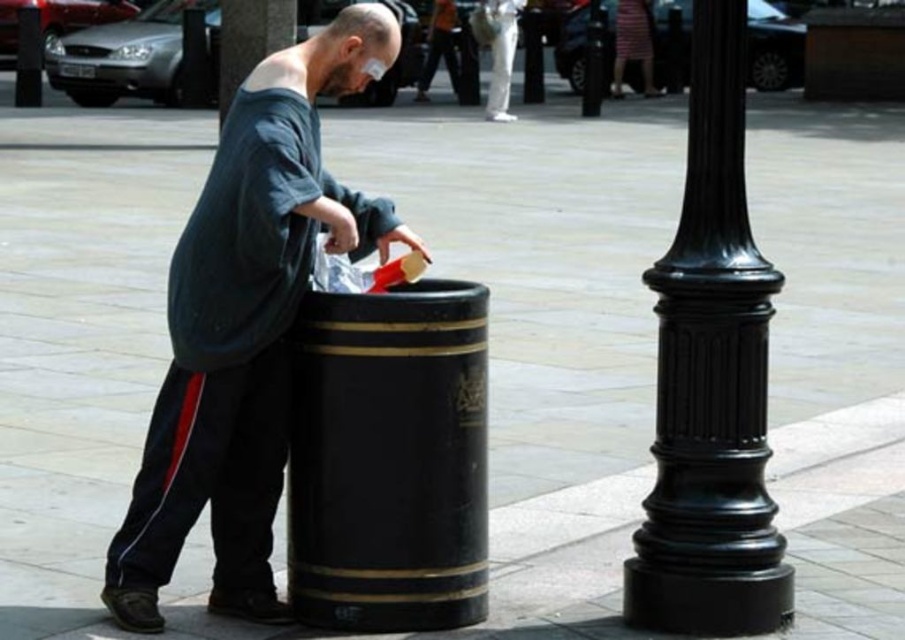
Question: Among these points, which one is farthest from the camera?

Choices:
 (A) (439, 420)
 (B) (237, 42)

Answer: (B)

Question: Is matte black trash can at center to the left of black polished barrel at center from the viewer's perspective?

Choices:
 (A) yes
 (B) no

Answer: (A)

Question: Among these objects, which one is farthest from the camera?

Choices:
 (A) matte black trash can at center
 (B) black polished barrel at center

Answer: (B)

Question: Which point is closer to the camera taking this photo?

Choices:
 (A) (713, 330)
 (B) (263, 24)
 (C) (405, 348)

Answer: (C)

Question: Does matte black trash can at center have a larger size compared to glossy black pole at right?

Choices:
 (A) yes
 (B) no

Answer: (A)

Question: Observing the image, what is the correct spatial positioning of black polished barrel at center in reference to black polished pole at center?

Choices:
 (A) left
 (B) right

Answer: (B)